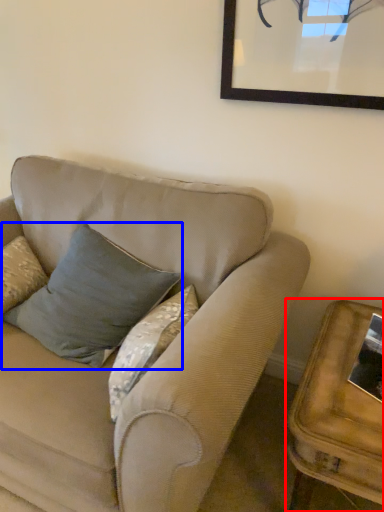
Question: Which point is closer to the camera, table (highlighted by a red box) or pillow (highlighted by a blue box)?

Choices:
 (A) table
 (B) pillow

Answer: (A)